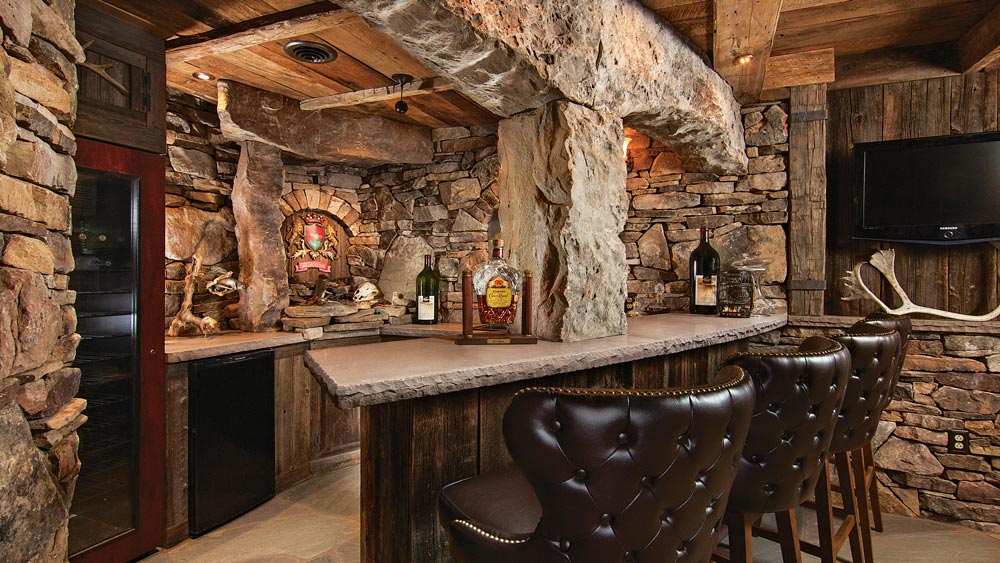
You are a GUI agent. You are given a task and a screenshot of the screen. Output one action in this format:
    pyautogui.click(x=<x>, y=<y>)
    Task: Click on the bar top
    
    Given the screenshot: What is the action you would take?
    pyautogui.click(x=443, y=358)